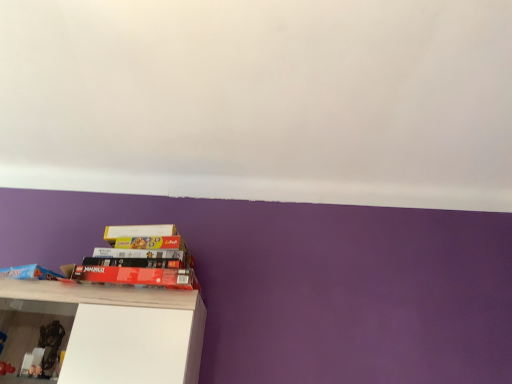
Question: Do you think matte blue book at lower left, the second book in the right-to-left sequence, is within matte black book at lower left, acting as the 2th book starting from the left, or outside of it?

Choices:
 (A) inside
 (B) outside

Answer: (B)

Question: Is point (33, 264) closer or farther from the camera than point (104, 269)?

Choices:
 (A) farther
 (B) closer

Answer: (A)

Question: Which object is the closest to the matte black book at lower left, which is counted as the first book, starting from the right?

Choices:
 (A) white glossy shelf at lower left
 (B) matte blue book at lower left, the second book in the right-to-left sequence

Answer: (A)

Question: Estimate the real-world distances between objects in this image. Which object is closer to the white glossy shelf at lower left?

Choices:
 (A) matte black book at lower left, acting as the 2th book starting from the left
 (B) matte blue book at lower left, the second book in the right-to-left sequence

Answer: (A)